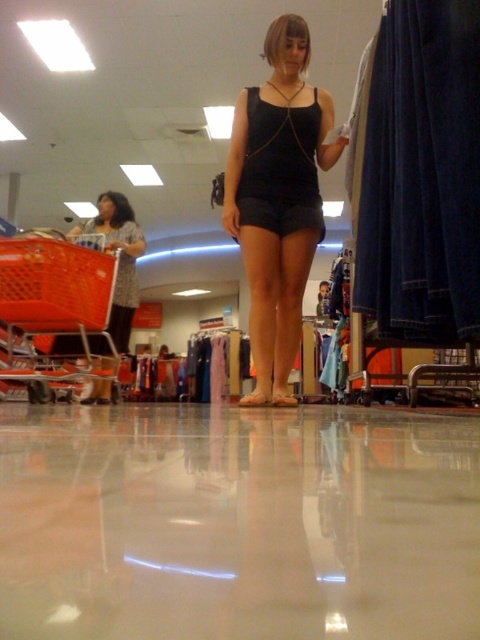
You are a fashion designer observing a model wearing the black matte shorts at center and the matte brown hair at left. Which item has a smaller size?

The black matte shorts at center has a smaller size compared to the matte brown hair at left.

You are a customer in a store and you see the orange plastic shopping cart at left and the matte brown hair at left. Which one is shorter in height?

The orange plastic shopping cart at left has a lesser height compared to matte brown hair at left, so the orange plastic shopping cart at left is shorter.

You are a fashion designer observing a model wearing the black matte shorts at center and the matte brown hair at left. Which part of the model is wider when viewed from the front?

The black matte shorts at center are wider than the matte brown hair at left.